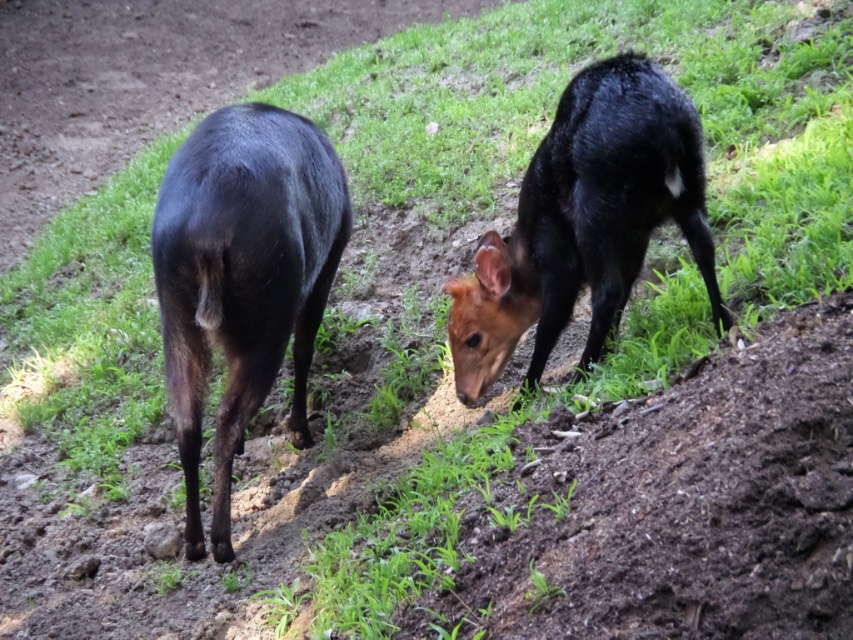
Question: Can you confirm if shiny black deer at left is positioned above shiny black deer at center?

Choices:
 (A) no
 (B) yes

Answer: (A)

Question: Observing the image, what is the correct spatial positioning of shiny black deer at left in reference to shiny black deer at center?

Choices:
 (A) above
 (B) below

Answer: (B)

Question: Which object is closer to the camera taking this photo?

Choices:
 (A) shiny black deer at center
 (B) shiny black deer at left

Answer: (B)

Question: Is shiny black deer at left above shiny black deer at center?

Choices:
 (A) no
 (B) yes

Answer: (A)

Question: Which point is closer to the camera taking this photo?

Choices:
 (A) (624, 124)
 (B) (248, 120)

Answer: (A)